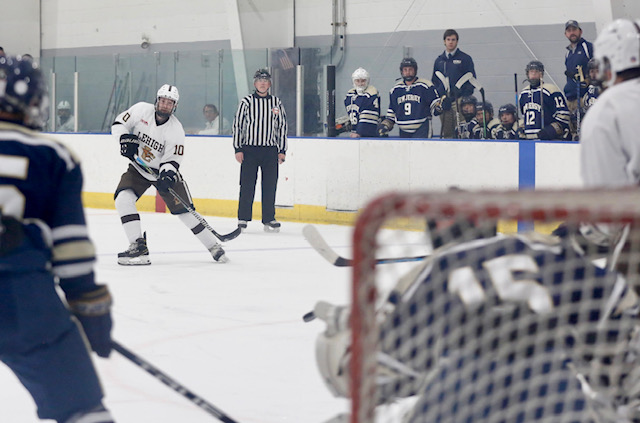
Where is `wall`? wall is located at coordinates (410, 161), (104, 157).